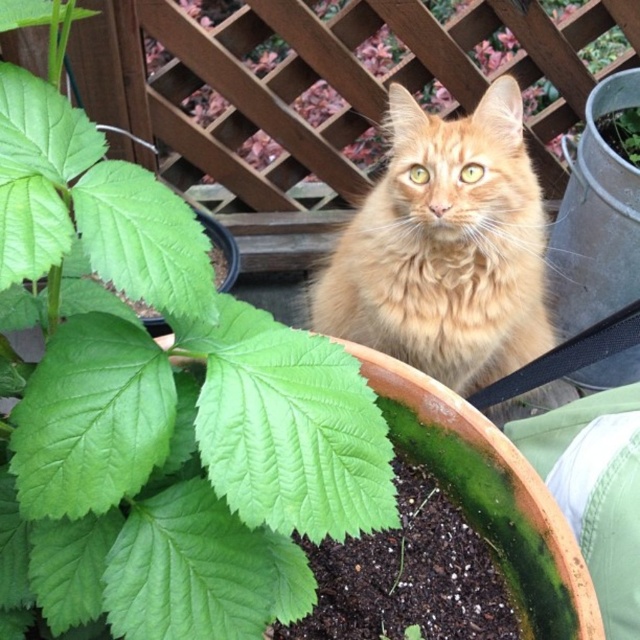
Question: Can you confirm if green matte leaf at center is thinner than golden fur cat at center?

Choices:
 (A) yes
 (B) no

Answer: (A)

Question: Is green matte leaf at center wider than golden fur cat at center?

Choices:
 (A) no
 (B) yes

Answer: (A)

Question: Which point is farther from the camera taking this photo?

Choices:
 (A) (465, 292)
 (B) (321, 348)

Answer: (A)

Question: Which object is closer to the camera taking this photo?

Choices:
 (A) golden fur cat at center
 (B) green matte leaf at center

Answer: (B)

Question: From the image, what is the correct spatial relationship of green matte leaf at center in relation to golden fur cat at center?

Choices:
 (A) below
 (B) above

Answer: (A)